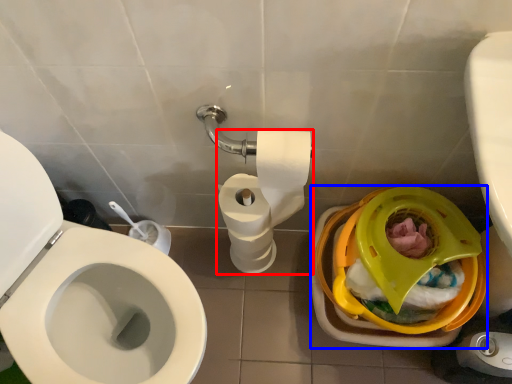
Question: Which point is further to the camera, toilet paper (highlighted by a red box) or potty (highlighted by a blue box)?

Choices:
 (A) toilet paper
 (B) potty

Answer: (A)